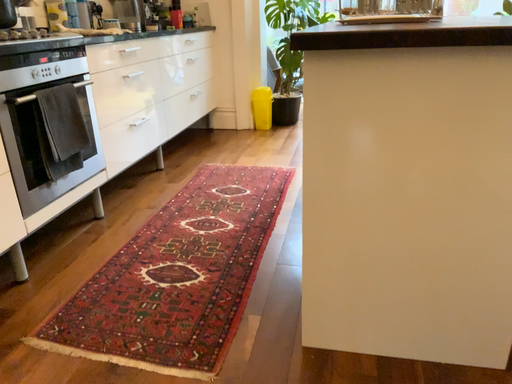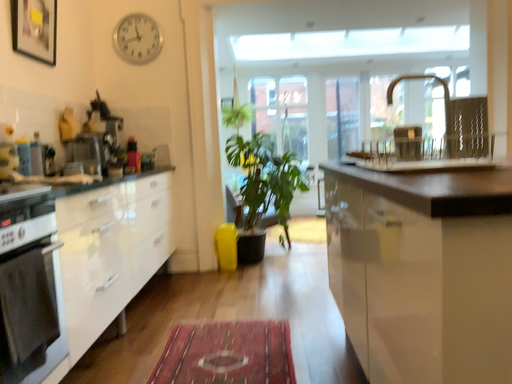
Question: How did the camera likely rotate when shooting the video?

Choices:
 (A) rotated right
 (B) rotated left

Answer: (A)